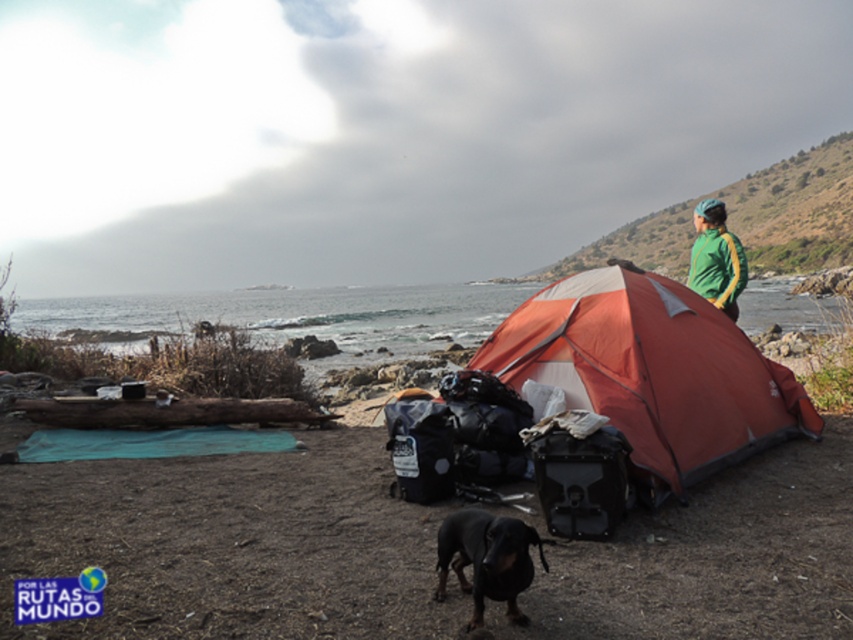
Question: Based on their relative distances, which object is nearer to the green/yellow track jacket at upper right?

Choices:
 (A) orange nylon tent at center
 (B) black smooth dog at lower center

Answer: (A)

Question: Can you confirm if black smooth dog at lower center is thinner than green/yellow track jacket at upper right?

Choices:
 (A) no
 (B) yes

Answer: (A)

Question: Considering the real-world distances, which object is farthest from the black smooth dog at lower center?

Choices:
 (A) orange nylon tent at center
 (B) green/yellow track jacket at upper right

Answer: (B)

Question: Is orange nylon tent at center in front of black smooth dog at lower center?

Choices:
 (A) yes
 (B) no

Answer: (B)

Question: Does orange nylon tent at center have a smaller size compared to black smooth dog at lower center?

Choices:
 (A) yes
 (B) no

Answer: (B)

Question: Which object is farther from the camera taking this photo?

Choices:
 (A) orange nylon tent at center
 (B) black smooth dog at lower center
 (C) green/yellow track jacket at upper right

Answer: (C)